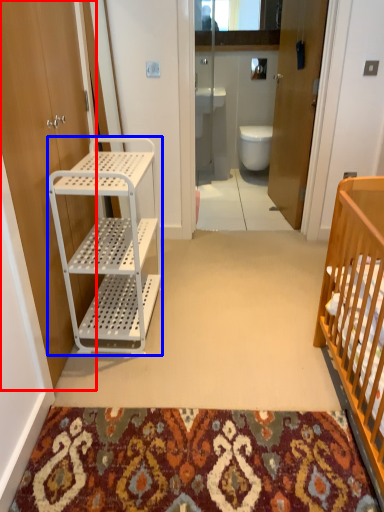
Question: Which of the following is the closest to the observer, door (highlighted by a red box) or cabinetry (highlighted by a blue box)?

Choices:
 (A) door
 (B) cabinetry

Answer: (A)